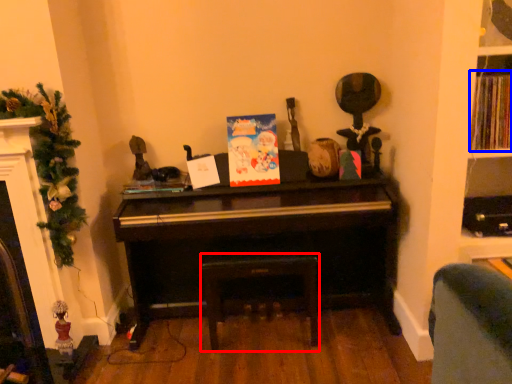
Question: Which of the following is the farthest to the observer, stool (highlighted by a red box) or book (highlighted by a blue box)?

Choices:
 (A) stool
 (B) book

Answer: (A)